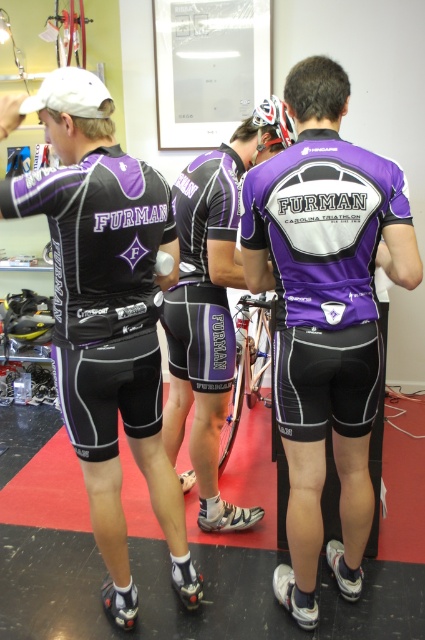
What do you see at coordinates (323, 227) in the screenshot? I see `purple matte jersey at center` at bounding box center [323, 227].

Is point (325, 273) closer to viewer compared to point (266, 141)?

Yes, it is.

Is point (305, 296) more distant than point (252, 120)?

No.

Where is `purple matte jersey at center`? The height and width of the screenshot is (640, 425). purple matte jersey at center is located at coordinates (323, 227).

Is point (189, 342) closer to camera compared to point (272, 141)?

Yes, it is in front of point (272, 141).

Which is above, purple matte tri suit at center or shiny multicolored helmet at center?

Positioned higher is shiny multicolored helmet at center.

Measure the distance between point (218, 316) and camera.

6.81 feet

Locate an element on the screen. purple matte tri suit at center is located at coordinates (203, 272).

Which is above, purple matte shorts at center or silver metallic bicycle at center?

purple matte shorts at center

Can you confirm if purple matte shorts at center is smaller than silver metallic bicycle at center?

No, purple matte shorts at center is not smaller than silver metallic bicycle at center.

Measure the distance between point (180,262) and camera.

Point (180,262) is 6.63 feet away from camera.

The width and height of the screenshot is (425, 640). Find the location of `purple matte shorts at center`. purple matte shorts at center is located at coordinates (206, 317).